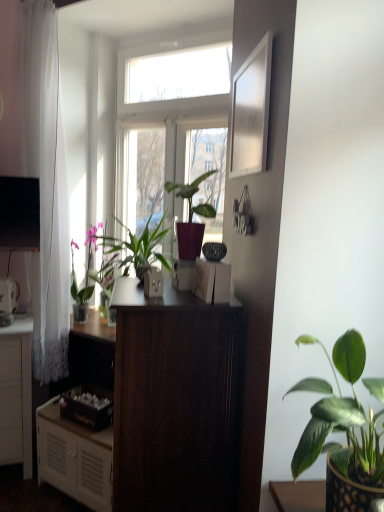
What do you see at coordinates (19, 213) in the screenshot? This screenshot has width=384, height=512. I see `black glossy television at upper left` at bounding box center [19, 213].

Locate an element on the screen. matte black speaker at center, which is the fifth appliance from back to front is located at coordinates (212, 281).

Describe the element at coordinates (153, 282) in the screenshot. I see `matte white outlet at center, which appears as the second appliance when viewed from the top` at that location.

Find the location of a particular element. transparent glass window at center is located at coordinates (175, 83).

Locate an element on the screen. white lace curtain at left is located at coordinates (46, 188).

Where is `black glossy television at upper left`? black glossy television at upper left is located at coordinates (19, 213).

Is point (7, 237) closer or farther from the camera than point (162, 274)?

Point (7, 237) is positioned farther from the camera compared to point (162, 274).

Does black glossy television at upper left come behind matte white outlet at center, which is the fourth appliance in bottom-to-top order?

Yes, black glossy television at upper left is further from the viewer.

Is black glossy television at upper left oriented towards matte white outlet at center, the third appliance positioned from the right?

No.

Who is smaller, black glossy television at upper left or matte white outlet at center, which appears as the second appliance when viewed from the front?

matte white outlet at center, which appears as the second appliance when viewed from the front.

Does point (3, 188) come behind point (149, 268)?

Yes, it is behind point (149, 268).

Is black glossy television at upper left at the left side of matte green flowerpot at center?

Correct, you'll find black glossy television at upper left to the left of matte green flowerpot at center.

Is black glossy television at upper left in front of or behind matte green flowerpot at center in the image?

black glossy television at upper left is behind matte green flowerpot at center.

Considering the sizes of objects black glossy television at upper left and matte green flowerpot at center in the image provided, who is shorter, black glossy television at upper left or matte green flowerpot at center?

With less height is matte green flowerpot at center.

From a real-world perspective, is matte white outlet at center, the fourth appliance when ordered from back to front, above or below matte green flowerpot at center?

From a real-world perspective, matte white outlet at center, the fourth appliance when ordered from back to front, is physically above matte green flowerpot at center.

From the picture: In the image, is matte white outlet at center, the third appliance positioned from the right, positioned in front of or behind matte green flowerpot at center?

matte white outlet at center, the third appliance positioned from the right, is in front of matte green flowerpot at center.

Find the location of `flowerpot above the matte white outlet at center, the fourth appliance when ordered from back to front (from the image's perspective)`. flowerpot above the matte white outlet at center, the fourth appliance when ordered from back to front (from the image's perspective) is located at coordinates (142, 271).

Which is farther, (154, 272) or (139, 273)?

The point (139, 273) is behind.

Is point (173, 279) in front of point (11, 309)?

Yes, it is.

Can you confirm if white glossy coffee maker at center, which is the third appliance from front to back, is positioned to the right of metallic silver toaster at left, acting as the fifth appliance starting from the right?

Yes, white glossy coffee maker at center, which is the third appliance from front to back, is to the right of metallic silver toaster at left, acting as the fifth appliance starting from the right.

Which object is closer to the camera, white glossy coffee maker at center, placed as the second appliance when sorted from right to left, or metallic silver toaster at left, acting as the fifth appliance starting from the right?

white glossy coffee maker at center, placed as the second appliance when sorted from right to left.

Can you confirm if white matte cabinet at lower left is thinner than metallic silver toaster at left, which appears as the 4th appliance when viewed from the top?

No.

Where is `the 2nd appliance above the white matte cabinet at lower left (from the image's perspective)`? The image size is (384, 512). the 2nd appliance above the white matte cabinet at lower left (from the image's perspective) is located at coordinates (8, 295).

Can you tell me how much white matte cabinet at lower left and metallic silver toaster at left, acting as the fifth appliance starting from the front, differ in facing direction?

There is a 40.8-degree angle between the facing directions of white matte cabinet at lower left and metallic silver toaster at left, acting as the fifth appliance starting from the front.

Considering the relative positions of white matte cabinet at lower left and metallic silver toaster at left, which appears as the 4th appliance when viewed from the top, in the image provided, is white matte cabinet at lower left to the left of metallic silver toaster at left, which appears as the 4th appliance when viewed from the top, from the viewer's perspective?

Incorrect, white matte cabinet at lower left is not on the left side of metallic silver toaster at left, which appears as the 4th appliance when viewed from the top.

Is point (42, 176) in front of point (93, 473)?

No, it is behind (93, 473).

How far apart are white lace curtain at left and white matte cabinet at lower left?

white lace curtain at left is 28.82 inches away from white matte cabinet at lower left.

From a real-world perspective, is white lace curtain at left positioned over white matte cabinet at lower left based on gravity?

Yes, from a real-world perspective, white lace curtain at left is on top of white matte cabinet at lower left.

Considering the sizes of white lace curtain at left and white matte cabinet at lower left in the image, is white lace curtain at left wider or thinner than white matte cabinet at lower left?

In the image, white lace curtain at left appears to be more narrow than white matte cabinet at lower left.

Which of these two, wooden crate at lower left, the fourth appliance positioned from the front, or metallic silver toaster at left, which appears as the 4th appliance when viewed from the top, stands taller?

metallic silver toaster at left, which appears as the 4th appliance when viewed from the top.

Can you confirm if wooden crate at lower left, the 5th appliance viewed from the top, is positioned to the left of metallic silver toaster at left, marked as the first appliance in a back-to-front arrangement?

No.

Does point (106, 421) come in front of point (4, 284)?

That is True.

Is wooden crate at lower left, acting as the 1th appliance starting from the bottom, positioned far away from metallic silver toaster at left, positioned as the 2th appliance in bottom-to-top order?

No, wooden crate at lower left, acting as the 1th appliance starting from the bottom, is in close proximity to metallic silver toaster at left, positioned as the 2th appliance in bottom-to-top order.

Find the location of a particular element. the 2nd appliance counting from the right of the black glossy television at upper left is located at coordinates (153, 282).

Where is `television on the left of matte green flowerpot at center`? The image size is (384, 512). television on the left of matte green flowerpot at center is located at coordinates (19, 213).

Which object lies nearer to the anchor point white matte cabinet at lower left, white glossy coffee maker at center, the first appliance viewed from the top, or matte white outlet at center, which appears as the second appliance when viewed from the top?

Based on the image, matte white outlet at center, which appears as the second appliance when viewed from the top, appears to be nearer to white matte cabinet at lower left.

Looking at the image, which one is located closer to white matte cabinet at lower left, white glossy coffee maker at center, which is counted as the third appliance, starting from the back, or dark wood desk at center?

Among the two, dark wood desk at center is located nearer to white matte cabinet at lower left.

Based on the photo, based on their spatial positions, is white lace curtain at left or transparent glass window at center closer to white glossy picture frame at upper right?

transparent glass window at center lies closer to white glossy picture frame at upper right than the other object.

Consider the image. From the image, which object appears to be farther from green matte plant at center, the second houseplant viewed from the front, matte green flowerpot at center or green glossy leafy plant at lower right, positioned as the 1th houseplant in front-to-back order?

green glossy leafy plant at lower right, positioned as the 1th houseplant in front-to-back order, lies further to green matte plant at center, the second houseplant viewed from the front, than the other object.

Which object lies further to the anchor point metallic silver toaster at left, which appears as the 1th appliance when viewed from the left, green glossy plant at left, which is the 1th houseplant in back-to-front order, or green matte plant at center, the 2th houseplant in the left-to-right sequence?

green matte plant at center, the 2th houseplant in the left-to-right sequence, is positioned further to the anchor metallic silver toaster at left, which appears as the 1th appliance when viewed from the left.

Based on their spatial positions, is green matte plant at center, acting as the second houseplant starting from the right, or green glossy plant at left, which is the first houseplant in left-to-right order, further from matte black speaker at center, the 5th appliance when ordered from left to right?

green glossy plant at left, which is the first houseplant in left-to-right order.

Looking at the image, which one is located closer to green glossy plant at left, which is the 1th houseplant in back-to-front order, matte black speaker at center, which is the fifth appliance from back to front, or green glossy leafy plant at lower right, the third houseplant in the back-to-front sequence?

The object closer to green glossy plant at left, which is the 1th houseplant in back-to-front order, is matte black speaker at center, which is the fifth appliance from back to front.

Which object lies further to the anchor point transparent glass window at center, matte black speaker at center, arranged as the 3th appliance when viewed from the top, or white glossy coffee maker at center, which is the 4th appliance from left to right?

Among the two, matte black speaker at center, arranged as the 3th appliance when viewed from the top, is located further to transparent glass window at center.

This screenshot has height=512, width=384. I want to click on desk between matte white outlet at center, which appears as the second appliance when viewed from the top, and wooden crate at lower left, which appears as the 2th appliance when viewed from the left, in the up-down direction, so click(175, 401).

Where is `desk between white lace curtain at left and white matte cabinet at lower left in the up-down direction`? This screenshot has width=384, height=512. desk between white lace curtain at left and white matte cabinet at lower left in the up-down direction is located at coordinates (175, 401).

I want to click on cabinetry positioned between green glossy leafy plant at lower right, positioned as the 1th houseplant in front-to-back order, and black glossy television at upper left from near to far, so click(74, 458).

You are a GUI agent. You are given a task and a screenshot of the screen. Output one action in this format:
    pyautogui.click(x=<x>, y=<y>)
    Task: Click on the cabinetry between metallic silver toaster at left, which appears as the 4th appliance when viewed from the top, and matte black speaker at center, acting as the 3th appliance starting from the bottom, from left to right
    The width and height of the screenshot is (384, 512).
    Given the screenshot: What is the action you would take?
    pyautogui.click(x=74, y=458)